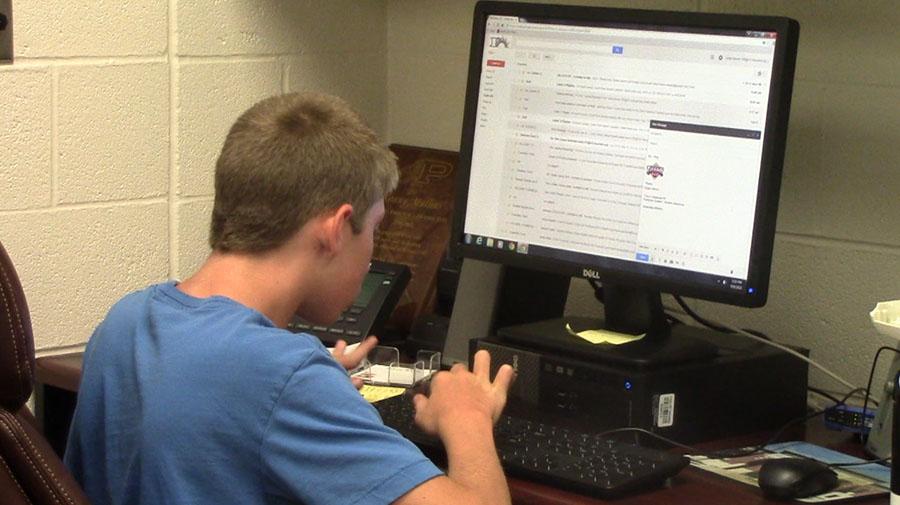
This screenshot has height=505, width=900. Find the location of `mousepad`. mousepad is located at coordinates coord(730,465).